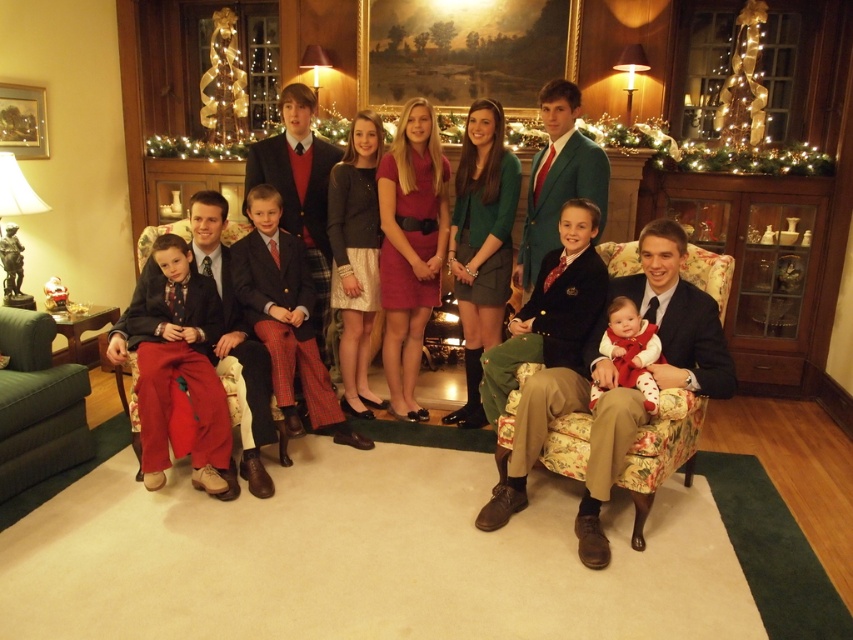
Which of these two, matte red pants at lower left or green fabric armchair at lower left, stands taller?

With more height is matte red pants at lower left.

Who is positioned more to the right, matte red pants at lower left or green fabric armchair at lower left?

Positioned to the right is matte red pants at lower left.

The image size is (853, 640). What do you see at coordinates (177, 365) in the screenshot?
I see `matte red pants at lower left` at bounding box center [177, 365].

The height and width of the screenshot is (640, 853). What are the coordinates of `matte red pants at lower left` in the screenshot? It's located at (177, 365).

Between matte black suit at center and matte red dress at center, which one is positioned lower?

matte black suit at center

Can you confirm if matte black suit at center is shorter than matte red dress at center?

In fact, matte black suit at center may be taller than matte red dress at center.

Between point (669, 323) and point (648, 387), which one is positioned in front?

Positioned in front is point (648, 387).

I want to click on matte black suit at center, so click(573, 452).

Is matte black suit at center above floral fabric armchair at center?

Correct, matte black suit at center is located above floral fabric armchair at center.

Is point (523, 440) positioned before point (672, 364)?

Yes, point (523, 440) is closer to viewer.

Find the location of `matte black suit at center`. matte black suit at center is located at coordinates (573, 452).